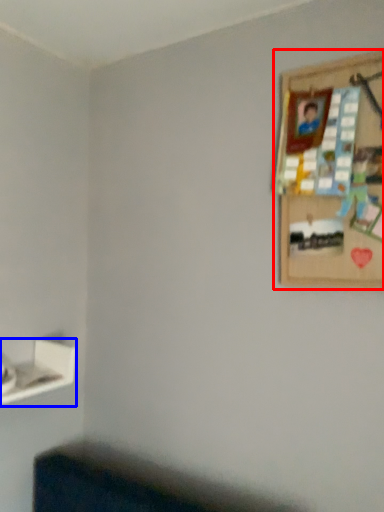
Question: Which object appears closest to the camera in this image, picture frame (highlighted by a red box) or shelf (highlighted by a blue box)?

Choices:
 (A) picture frame
 (B) shelf

Answer: (A)